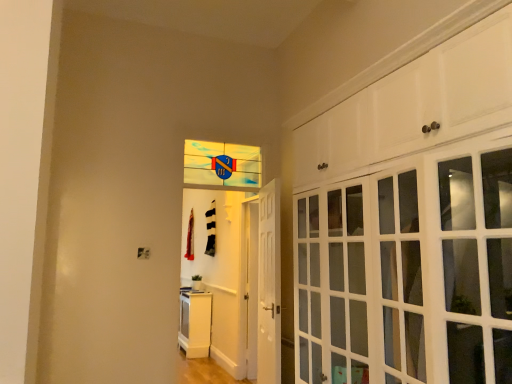
What is the approximate width of white glossy door at center?

white glossy door at center is 7.56 inches in width.

The width and height of the screenshot is (512, 384). What do you see at coordinates (410, 222) in the screenshot? I see `white glossy cabinet doors at upper right, placed as the first cabinetry when sorted from right to left` at bounding box center [410, 222].

At what (x,y) coordinates should I click in order to perform the action: click on white glossy cabinet at lower left, the 2th cabinetry in the front-to-back sequence. Please return your answer as a coordinate pair (x, y). Looking at the image, I should click on (195, 323).

Where is `white glossy door at center`? This screenshot has height=384, width=512. white glossy door at center is located at coordinates (269, 285).

Is translucent glass window at center looking in the opposite direction of white glossy cabinet doors at upper right, marked as the 1th cabinetry in a front-to-back arrangement?

No, translucent glass window at center's orientation is not away from white glossy cabinet doors at upper right, marked as the 1th cabinetry in a front-to-back arrangement.

Which object is more forward, translucent glass window at center or white glossy cabinet doors at upper right, marked as the 1th cabinetry in a front-to-back arrangement?

white glossy cabinet doors at upper right, marked as the 1th cabinetry in a front-to-back arrangement.

Is translucent glass window at center taller than white glossy cabinet doors at upper right, the 2th cabinetry from the back?

In fact, translucent glass window at center may be shorter than white glossy cabinet doors at upper right, the 2th cabinetry from the back.

From a real-world perspective, is translucent glass window at center physically located above or below white glossy cabinet doors at upper right, which is counted as the second cabinetry, starting from the bottom?

translucent glass window at center is above white glossy cabinet doors at upper right, which is counted as the second cabinetry, starting from the bottom.

Which object is wider, white glossy door at center or white glossy cabinet doors at upper right, which is counted as the 1th cabinetry, starting from the top?

white glossy cabinet doors at upper right, which is counted as the 1th cabinetry, starting from the top.

Is white glossy door at center with white glossy cabinet doors at upper right, marked as the 1th cabinetry in a front-to-back arrangement?

No, white glossy door at center is not making contact with white glossy cabinet doors at upper right, marked as the 1th cabinetry in a front-to-back arrangement.

Is white glossy door at center positioned with its back to white glossy cabinet doors at upper right, which is counted as the 1th cabinetry, starting from the top?

No, white glossy door at center is not facing away from white glossy cabinet doors at upper right, which is counted as the 1th cabinetry, starting from the top.

Considering the positions of point (257, 353) and point (187, 160), is point (257, 353) closer or farther from the camera than point (187, 160)?

Point (257, 353) is farther from the camera than point (187, 160).

Which of these two, white glossy door at center or translucent glass window at center, stands taller?

With more height is white glossy door at center.

Is white glossy door at center located outside translucent glass window at center?

Yes, white glossy door at center is outside of translucent glass window at center.

From the picture: Between white glossy door at center and translucent glass window at center, which one is positioned in front?

white glossy door at center is closer to the camera.

Who is taller, white glossy cabinet doors at upper right, marked as the 1th cabinetry in a front-to-back arrangement, or white glossy cabinet at lower left, the 2th cabinetry positioned from the right?

With more height is white glossy cabinet doors at upper right, marked as the 1th cabinetry in a front-to-back arrangement.

Is white glossy cabinet doors at upper right, which is counted as the 1th cabinetry, starting from the top, oriented towards white glossy cabinet at lower left, acting as the first cabinetry starting from the back?

No, white glossy cabinet doors at upper right, which is counted as the 1th cabinetry, starting from the top, is not oriented towards white glossy cabinet at lower left, acting as the first cabinetry starting from the back.

Can you confirm if white glossy cabinet doors at upper right, the 2th cabinetry from the back, is thinner than white glossy cabinet at lower left, acting as the first cabinetry starting from the back?

No, white glossy cabinet doors at upper right, the 2th cabinetry from the back, is not thinner than white glossy cabinet at lower left, acting as the first cabinetry starting from the back.

Is the position of white glossy cabinet at lower left, the 2th cabinetry positioned from the right, more distant than that of white glossy cabinet doors at upper right, marked as the 1th cabinetry in a front-to-back arrangement?

Yes, white glossy cabinet at lower left, the 2th cabinetry positioned from the right, is further from the camera.

In the scene shown: Is the surface of white glossy cabinet at lower left, the first cabinetry when ordered from bottom to top, in direct contact with white glossy cabinet doors at upper right, which is counted as the 1th cabinetry, starting from the top?

white glossy cabinet at lower left, the first cabinetry when ordered from bottom to top, and white glossy cabinet doors at upper right, which is counted as the 1th cabinetry, starting from the top, are clearly separated.

Can white glossy cabinet doors at upper right, which appears as the 2th cabinetry when viewed from the left, be found inside white glossy cabinet at lower left, which is the first cabinetry in left-to-right order?

No, white glossy cabinet at lower left, which is the first cabinetry in left-to-right order, does not contain white glossy cabinet doors at upper right, which appears as the 2th cabinetry when viewed from the left.

From the image's perspective, is white glossy cabinet at lower left, the 2th cabinetry positioned from the right, under white glossy cabinet doors at upper right, which is counted as the second cabinetry, starting from the bottom?

Yes, from the image's perspective, white glossy cabinet at lower left, the 2th cabinetry positioned from the right, is beneath white glossy cabinet doors at upper right, which is counted as the second cabinetry, starting from the bottom.

From a real-world perspective, is white glossy cabinet doors at upper right, which is counted as the second cabinetry, starting from the bottom, above or below translucent glass window at center?

In terms of real-world spatial position, white glossy cabinet doors at upper right, which is counted as the second cabinetry, starting from the bottom, is below translucent glass window at center.

Is point (456, 42) positioned after point (203, 180)?

No, it is not.

Considering the relative sizes of white glossy cabinet doors at upper right, marked as the 1th cabinetry in a front-to-back arrangement, and translucent glass window at center in the image provided, is white glossy cabinet doors at upper right, marked as the 1th cabinetry in a front-to-back arrangement, wider than translucent glass window at center?

Yes, white glossy cabinet doors at upper right, marked as the 1th cabinetry in a front-to-back arrangement, is wider than translucent glass window at center.

The width and height of the screenshot is (512, 384). In order to click on window above the white glossy cabinet doors at upper right, which appears as the 2th cabinetry when viewed from the left (from a real-world perspective) in this screenshot , I will do `click(222, 166)`.

Is white glossy cabinet at lower left, the first cabinetry when ordered from bottom to top, inside white glossy door at center?

No, white glossy cabinet at lower left, the first cabinetry when ordered from bottom to top, is located outside of white glossy door at center.

Based on the photo, who is shorter, white glossy door at center or white glossy cabinet at lower left, the first cabinetry when ordered from bottom to top?

white glossy cabinet at lower left, the first cabinetry when ordered from bottom to top.

Looking at this image, considering the sizes of white glossy door at center and white glossy cabinet at lower left, acting as the first cabinetry starting from the back, in the image, is white glossy door at center bigger or smaller than white glossy cabinet at lower left, acting as the first cabinetry starting from the back,?

In the image, white glossy door at center appears to be smaller than white glossy cabinet at lower left, acting as the first cabinetry starting from the back.

At what (x,y) coordinates should I click in order to perform the action: click on window that appears above the white glossy cabinet doors at upper right, placed as the first cabinetry when sorted from right to left (from a real-world perspective). Please return your answer as a coordinate pair (x, y). The height and width of the screenshot is (384, 512). Looking at the image, I should click on (222, 166).

Where is `door below the white glossy cabinet doors at upper right, which is counted as the second cabinetry, starting from the bottom (from a real-world perspective)`? The height and width of the screenshot is (384, 512). door below the white glossy cabinet doors at upper right, which is counted as the second cabinetry, starting from the bottom (from a real-world perspective) is located at coordinates (269, 285).

Estimate the real-world distances between objects in this image. Which object is closer to white glossy cabinet doors at upper right, marked as the 1th cabinetry in a front-to-back arrangement, white glossy door at center or translucent glass window at center?

white glossy door at center.

Which object lies further to the anchor point white glossy cabinet at lower left, the first cabinetry when ordered from bottom to top, translucent glass window at center or white glossy cabinet doors at upper right, which appears as the 2th cabinetry when viewed from the left?

white glossy cabinet doors at upper right, which appears as the 2th cabinetry when viewed from the left, is further to white glossy cabinet at lower left, the first cabinetry when ordered from bottom to top.

Based on their spatial positions, is translucent glass window at center or white glossy cabinet at lower left, the first cabinetry when ordered from bottom to top, closer to white glossy door at center?

translucent glass window at center is closer to white glossy door at center.

Based on their spatial positions, is white glossy cabinet doors at upper right, which appears as the 2th cabinetry when viewed from the left, or white glossy cabinet at lower left, the 2th cabinetry in the front-to-back sequence, closer to translucent glass window at center?

white glossy cabinet doors at upper right, which appears as the 2th cabinetry when viewed from the left.

Which object lies nearer to the anchor point white glossy cabinet doors at upper right, which is counted as the second cabinetry, starting from the bottom, translucent glass window at center or white glossy cabinet at lower left, which is the first cabinetry in left-to-right order?

The object closer to white glossy cabinet doors at upper right, which is counted as the second cabinetry, starting from the bottom, is translucent glass window at center.

Looking at the image, which one is located closer to translucent glass window at center, white glossy door at center or white glossy cabinet at lower left, which is the first cabinetry in left-to-right order?

white glossy door at center.

Looking at this image, based on their spatial positions, is white glossy cabinet doors at upper right, which is counted as the second cabinetry, starting from the bottom, or white glossy door at center further from white glossy cabinet at lower left, acting as the second cabinetry starting from the top?

Among the two, white glossy cabinet doors at upper right, which is counted as the second cabinetry, starting from the bottom, is located further to white glossy cabinet at lower left, acting as the second cabinetry starting from the top.

Considering their positions, is white glossy door at center positioned further to white glossy cabinet at lower left, the 2th cabinetry positioned from the right, than white glossy cabinet doors at upper right, placed as the first cabinetry when sorted from right to left?

white glossy cabinet doors at upper right, placed as the first cabinetry when sorted from right to left, is positioned further to the anchor white glossy cabinet at lower left, the 2th cabinetry positioned from the right.

The width and height of the screenshot is (512, 384). I want to click on window positioned between white glossy cabinet doors at upper right, the 2th cabinetry from the back, and white glossy cabinet at lower left, the first cabinetry when ordered from bottom to top, from near to far, so click(222, 166).

Find the location of `door between white glossy cabinet doors at upper right, placed as the first cabinetry when sorted from right to left, and translucent glass window at center, along the z-axis`. door between white glossy cabinet doors at upper right, placed as the first cabinetry when sorted from right to left, and translucent glass window at center, along the z-axis is located at coordinates (269, 285).

Identify the location of window positioned between white glossy door at center and white glossy cabinet at lower left, which is the first cabinetry in left-to-right order, from near to far. (222, 166).

In order to click on door between white glossy cabinet doors at upper right, which is counted as the 1th cabinetry, starting from the top, and white glossy cabinet at lower left, the first cabinetry when ordered from bottom to top, from front to back in this screenshot , I will do (269, 285).